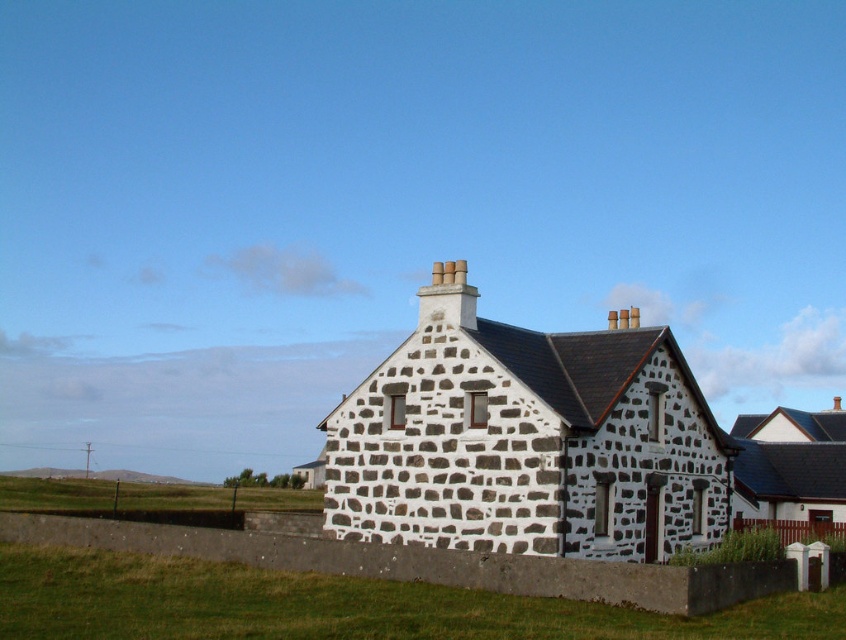
Question: Considering the relative positions of stone/brick cottage at center and white stone cottage at right in the image provided, where is stone/brick cottage at center located with respect to white stone cottage at right?

Choices:
 (A) right
 (B) left

Answer: (B)

Question: Which of the following is the farthest from the observer?

Choices:
 (A) (823, 442)
 (B) (540, 420)

Answer: (A)

Question: Which point is closer to the camera taking this photo?

Choices:
 (A) (743, 520)
 (B) (614, 481)
 (C) (3, 568)

Answer: (C)

Question: Which of these objects is positioned closest to the stone/brick cottage at center?

Choices:
 (A) green grass at lower center
 (B) white stone cottage at right

Answer: (A)

Question: Is the position of green grass at lower center less distant than that of white stone cottage at right?

Choices:
 (A) no
 (B) yes

Answer: (B)

Question: Considering the relative positions of stone/brick cottage at center and green grass at lower center in the image provided, where is stone/brick cottage at center located with respect to green grass at lower center?

Choices:
 (A) below
 (B) above

Answer: (B)